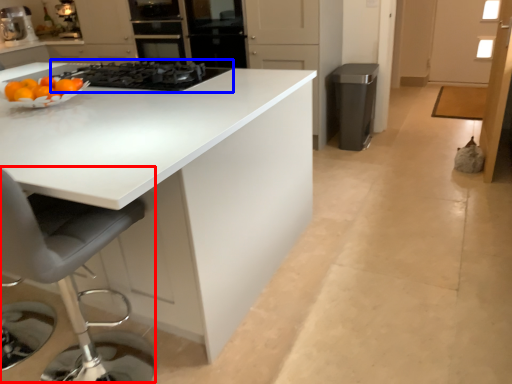
Question: Which of the following is the closest to the observer, swivel chair (highlighted by a red box) or gas stove (highlighted by a blue box)?

Choices:
 (A) swivel chair
 (B) gas stove

Answer: (A)